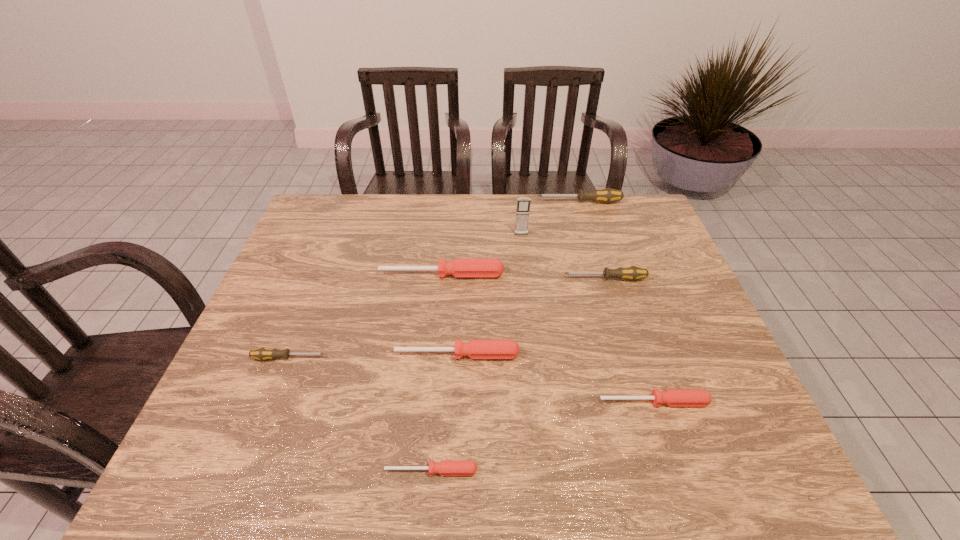
Locate an element on the screen. The image size is (960, 540). the fourth object from right to left is located at coordinates (523, 204).

The width and height of the screenshot is (960, 540). I want to click on the seventh nearest object, so click(x=523, y=204).

Identify the location of the farthest screwdriver. This screenshot has width=960, height=540. (607, 195).

This screenshot has width=960, height=540. In order to click on the farthest gray screwdriver in this screenshot , I will do `click(607, 195)`.

Image resolution: width=960 pixels, height=540 pixels. What are the coordinates of `the farthest red screwdriver` in the screenshot? It's located at (460, 268).

Locate an element on the screen. The width and height of the screenshot is (960, 540). the second smallest gray screwdriver is located at coordinates (632, 273).

Locate an element on the screen. The image size is (960, 540). the second farthest red screwdriver is located at coordinates (476, 349).

Identify the location of the sixth farthest screwdriver. Image resolution: width=960 pixels, height=540 pixels. (672, 397).

Identify the location of the rightmost red screwdriver. (672, 397).

You are a GUI agent. You are given a task and a screenshot of the screen. Output one action in this format:
    pyautogui.click(x=<x>, y=<y>)
    Task: Click on the smallest gray screwdriver
    The width and height of the screenshot is (960, 540).
    Given the screenshot: What is the action you would take?
    pyautogui.click(x=263, y=353)